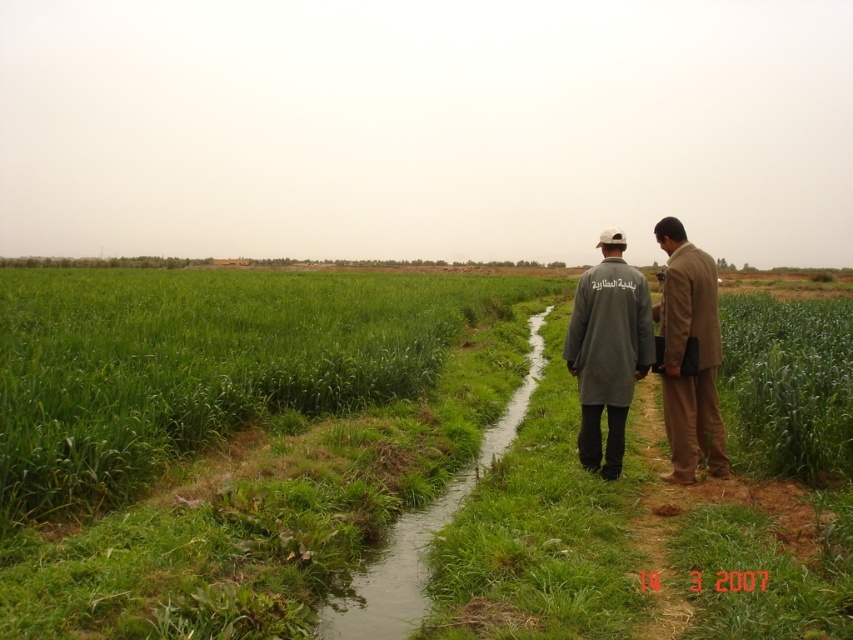
You are a photographer trying to capture a clear photo of the green grass at center and the brown fabric suit at right. Which object should you focus on first to ensure both are in focus?

The green grass at center is positioned over the brown fabric suit at right, so focusing on the green grass at center first will ensure both are in focus since it is closer to the camera.

You are a photographer trying to capture a photo of the green grass at center and the brown fabric suit at right. Which object should you focus on if you want to ensure the taller one is in sharp focus?

The green grass at center is taller than the brown fabric suit at right, so you should focus on the green grass at center to ensure the taller object is in sharp focus.